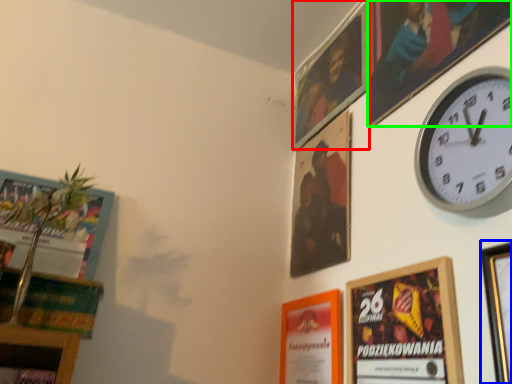
Question: Estimate the real-world distances between objects in this image. Which object is closer to picture frame (highlighted by a red box), picture frame (highlighted by a blue box) or picture frame (highlighted by a green box)?

Choices:
 (A) picture frame
 (B) picture frame

Answer: (B)